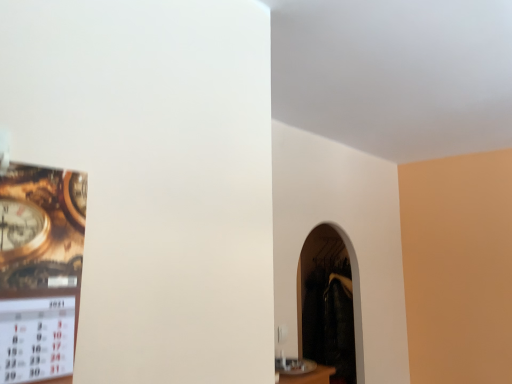
Question: Should I look upward or downward to see dark matte fireplace at center?

Choices:
 (A) up
 (B) down

Answer: (B)